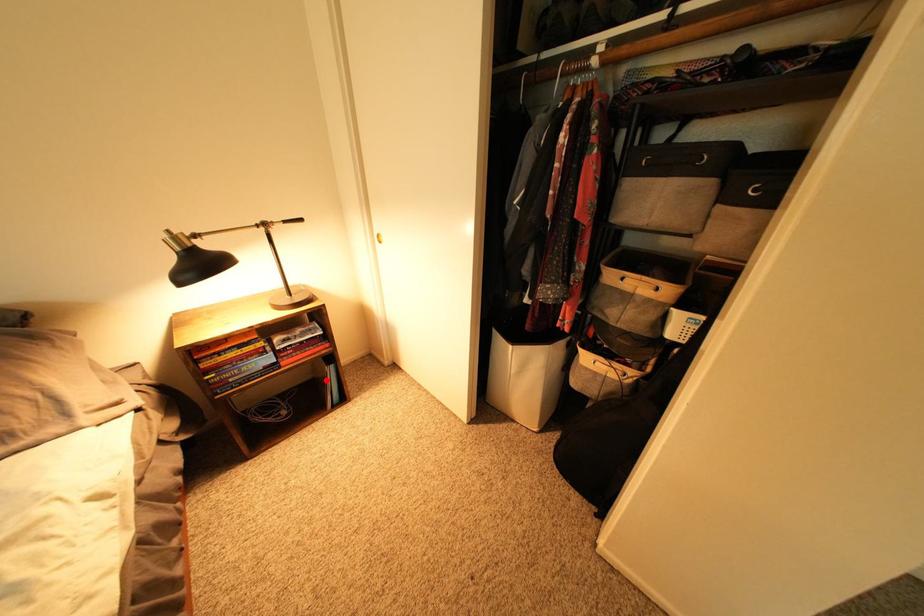
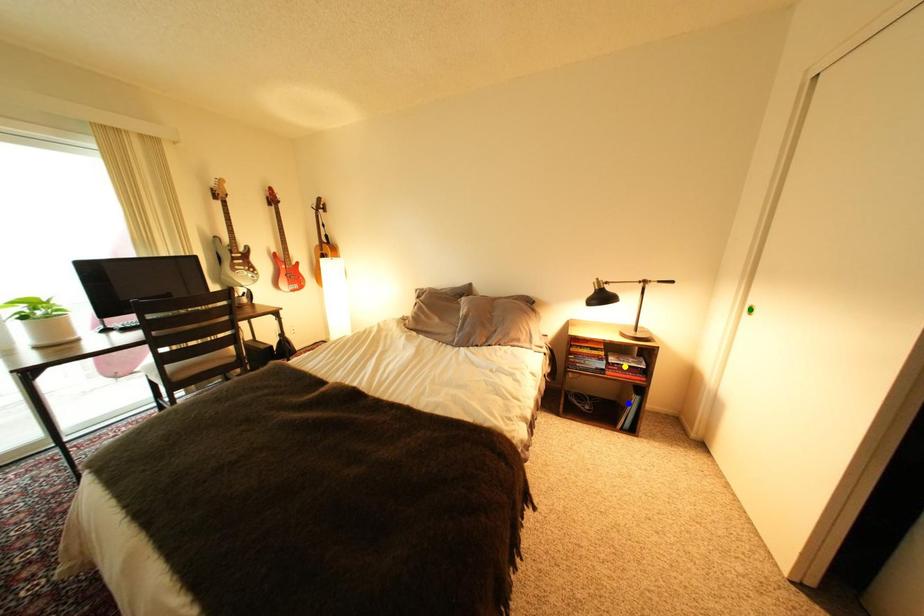
Question: I am providing you with two images of the same scene from different viewpoints. A red point is marked on the first image. You are given multiple points on the second image. Which spot in image 2 lines up with the point in image 1?

Choices:
 (A) yellow point
 (B) blue point
 (C) green point

Answer: (B)